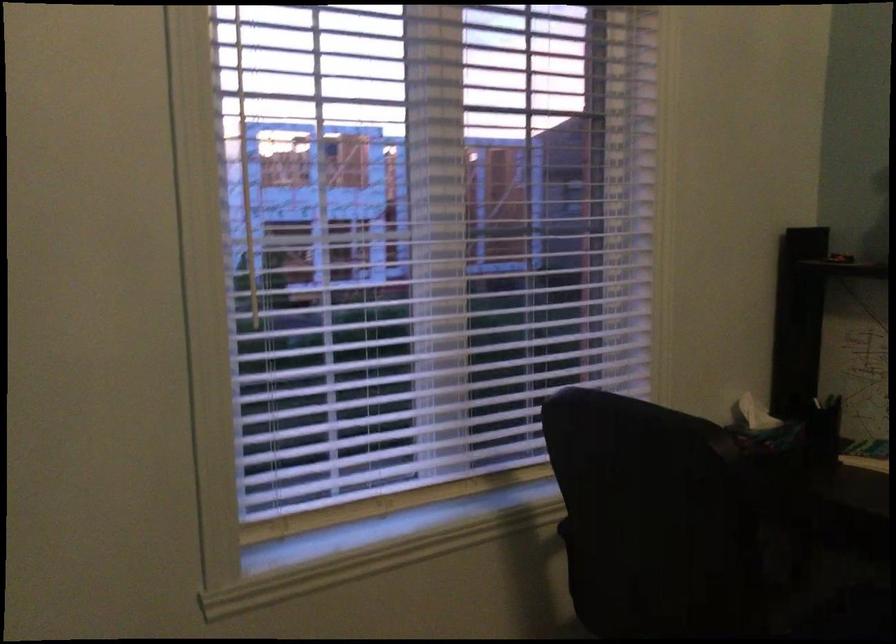
You are a GUI agent. You are given a task and a screenshot of the screen. Output one action in this format:
    pyautogui.click(x=<x>, y=<y>)
    Task: Click on the blind pull cord
    The width and height of the screenshot is (896, 644).
    Given the screenshot: What is the action you would take?
    pyautogui.click(x=316, y=234)